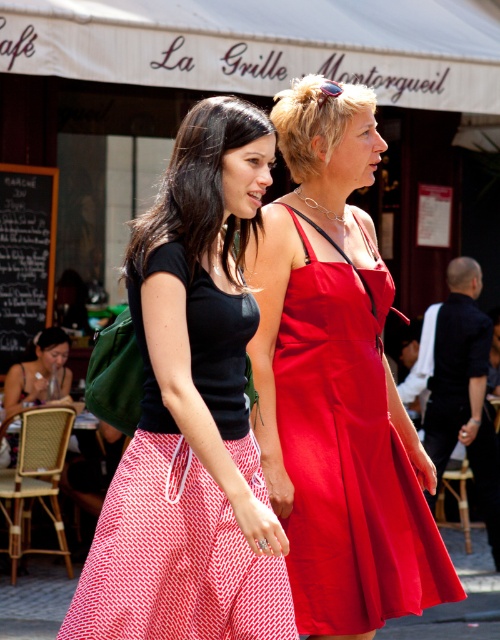
Does matte black top at center come in front of shiny satin dress at center?

Yes.

Is point (162, 266) behind point (277, 410)?

No, (162, 266) is closer to viewer.

This screenshot has width=500, height=640. Find the location of `matte black top at center`. matte black top at center is located at coordinates (192, 412).